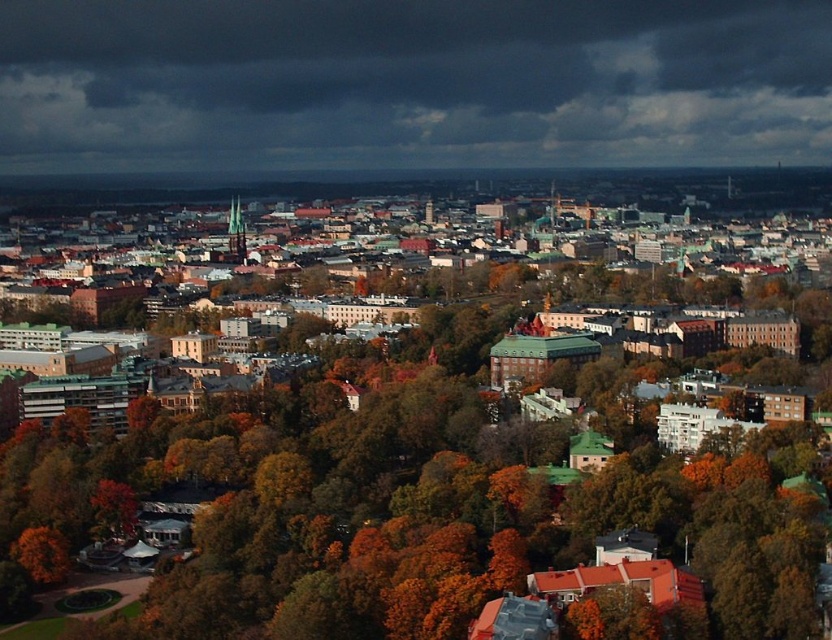
Question: Can you confirm if dark gray cloud at upper center is smaller than orange leafy tree at lower left?

Choices:
 (A) no
 (B) yes

Answer: (A)

Question: Considering the real-world distances, which object is closest to the orange leafy tree at lower left?

Choices:
 (A) brown/wooden trees at center
 (B) dark gray cloud at upper center

Answer: (A)

Question: Is brown/wooden trees at center above dark gray cloud at upper center?

Choices:
 (A) yes
 (B) no

Answer: (B)

Question: Which point is closer to the camera?

Choices:
 (A) (743, 1)
 (B) (63, 560)
 (C) (702, 500)

Answer: (C)

Question: Which object is closer to the camera taking this photo?

Choices:
 (A) orange leafy tree at lower left
 (B) dark gray cloud at upper center

Answer: (A)

Question: Can you confirm if brown/wooden trees at center is positioned to the left of dark gray cloud at upper center?

Choices:
 (A) no
 (B) yes

Answer: (B)